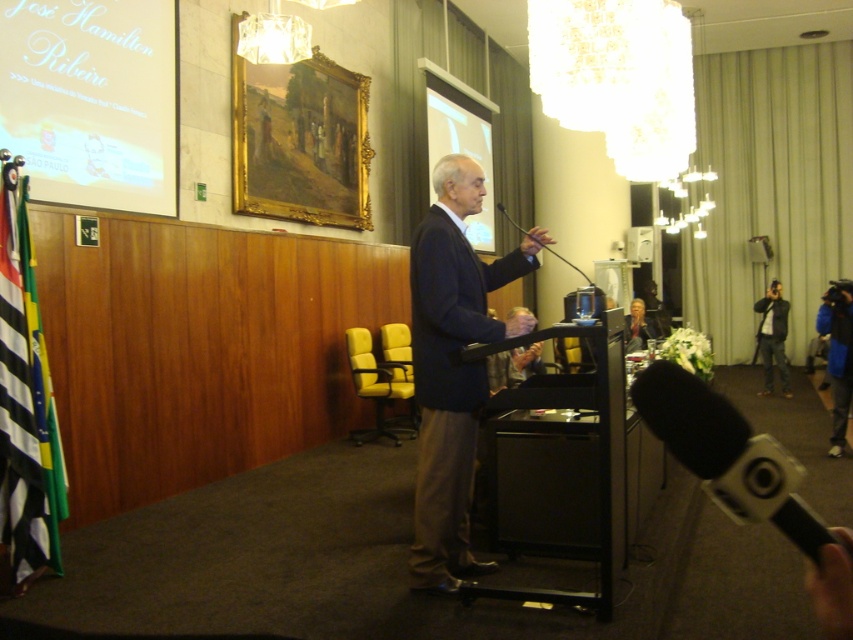
You are a photographer setting up equipment in the conference room. You have two cameras, the blue fabric camera at right and the gray fabric camera at right. You need to place them on a shelf that can only hold items up to 30 cm in height. Which camera should you choose to ensure it fits on the shelf?

The gray fabric camera at right is shorter than the blue fabric camera at right, so you should choose the gray fabric camera at right to ensure it fits on the shelf since it is under 30 cm in height.

Looking at this image, you are a photographer in a conference room. You see two cameras, the blue fabric camera at right and the gray fabric camera at right. Which one is located lower in the scene?

The blue fabric camera at right is located lower because it is positioned below the gray fabric camera at right.